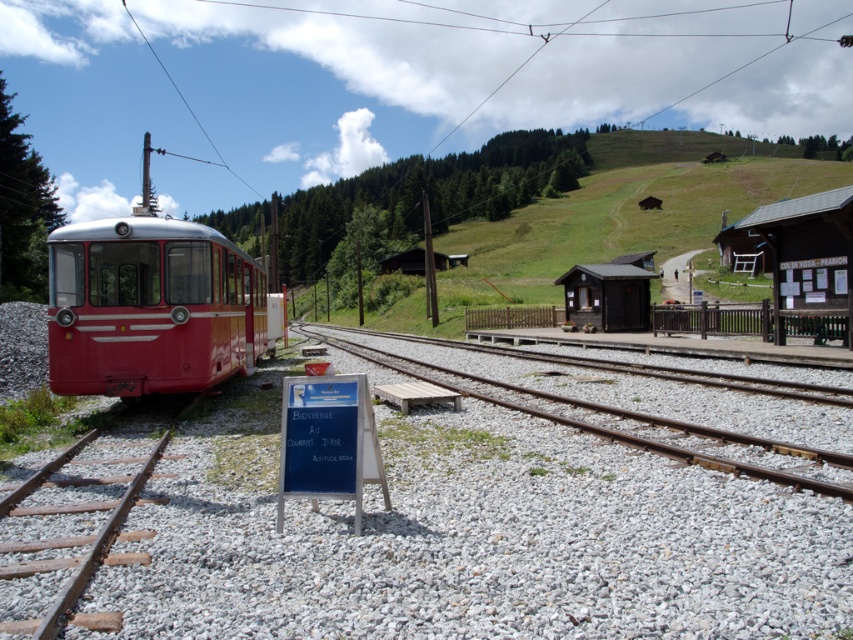
Who is taller, gray gravel at center or smooth gravel track at center?

gray gravel at center

Who is more forward, [80,532] or [670,426]?

Positioned in front is point [80,532].

Identify the location of gray gravel at center. (471, 531).

Find the location of `gray gravel at center`. gray gravel at center is located at coordinates coord(471,531).

Which is in front, point (474, 476) or point (86, 566)?

Point (86, 566) is more forward.

Can you confirm if gray gravel at center is shorter than brown wooden train track at lower left?

No.

Identify the location of gray gravel at center. (471, 531).

The image size is (853, 640). I want to click on gray gravel at center, so click(471, 531).

Does red polished metal train at left lie behind brown wooden signboard at right?

Answer: No, it is not.

From the picture: Can you confirm if red polished metal train at left is positioned above brown wooden signboard at right?

No.

The image size is (853, 640). Identify the location of red polished metal train at left. (149, 307).

Identify the location of red polished metal train at left. (149, 307).